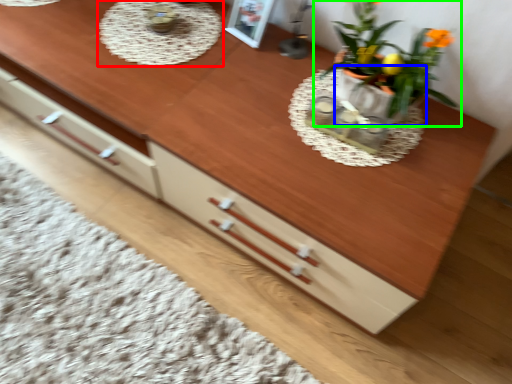
Question: Which is farther away from round table (highlighted by a red box)? flowerpot (highlighted by a blue box) or houseplant (highlighted by a green box)?

Choices:
 (A) flowerpot
 (B) houseplant

Answer: (A)